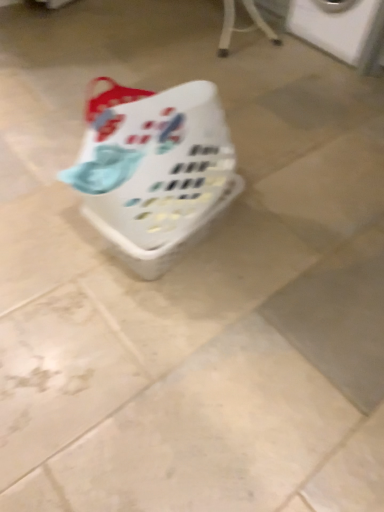
Identify the location of vacant region in front of white plastic basket at center. (155, 330).